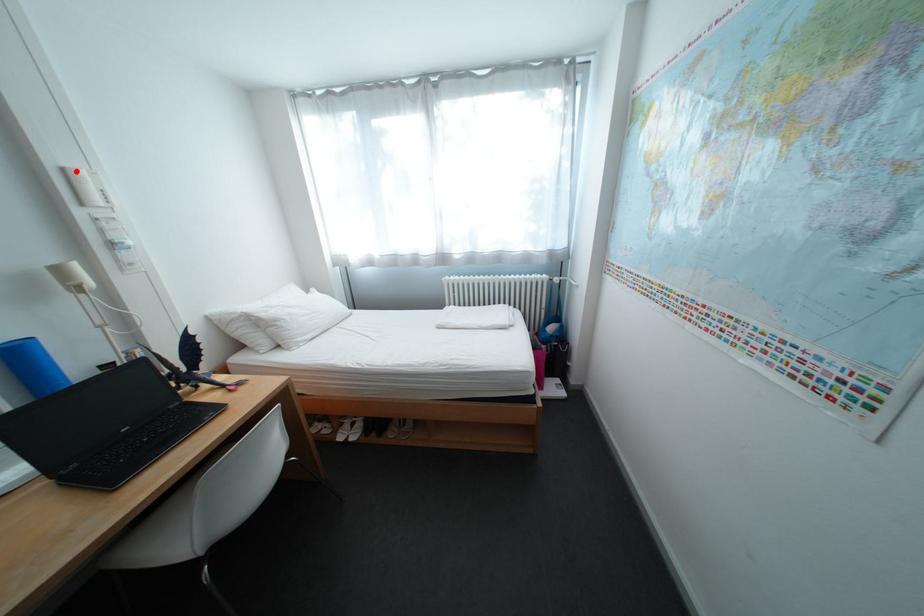
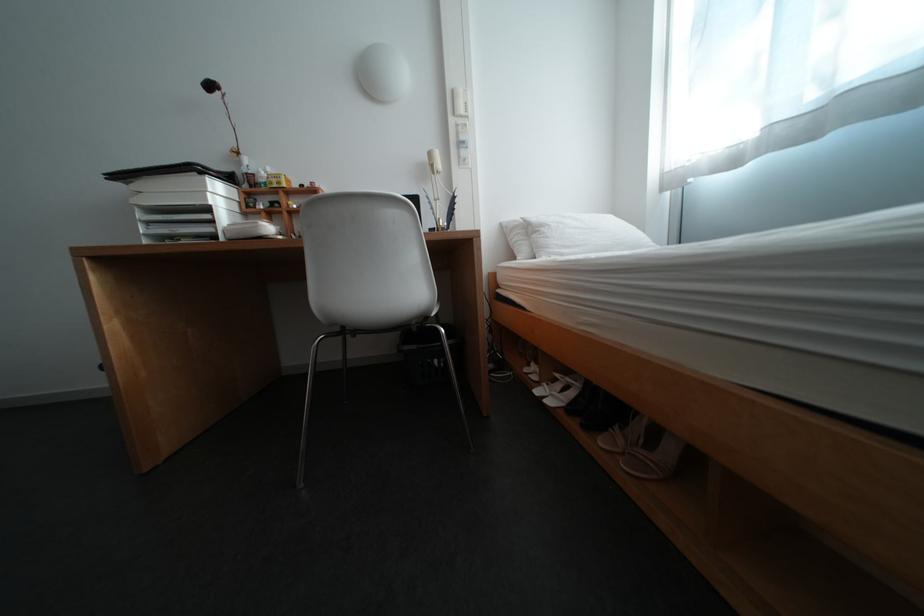
Find the pixel in the second image that matches the highlighted location in the first image.

(466, 92)